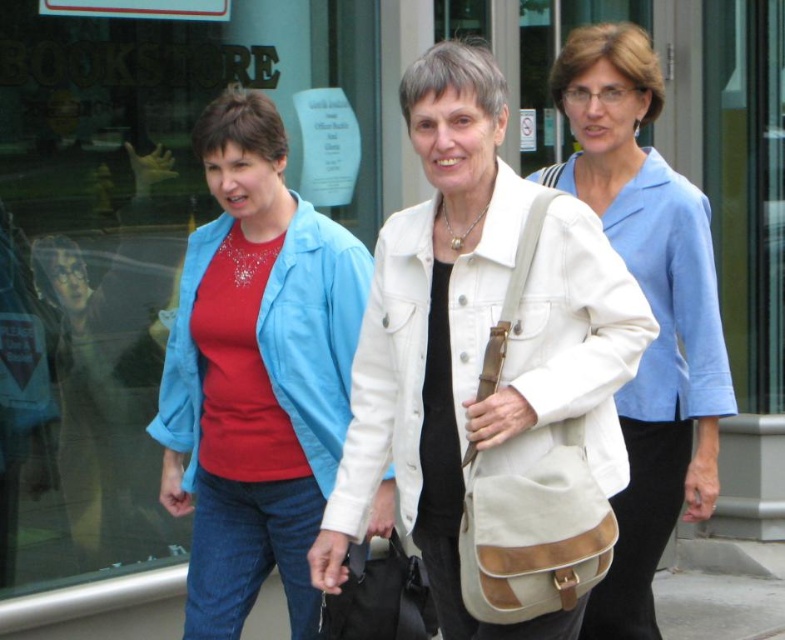
Question: Which object is positioned closest to the matte blue jacket at center?

Choices:
 (A) beige canvas briefcase at center
 (B) white canvas bag at center

Answer: (B)

Question: Which point appears farthest from the camera in this image?

Choices:
 (A) (279, 492)
 (B) (582, 173)
 (C) (466, 468)
 (D) (667, 392)

Answer: (B)

Question: Can you confirm if white canvas bag at center is positioned below matte blue jacket at center?

Choices:
 (A) yes
 (B) no

Answer: (B)

Question: Can you confirm if matte blue jacket at center is positioned to the right of beige canvas briefcase at center?

Choices:
 (A) no
 (B) yes

Answer: (A)

Question: Which object is positioned closest to the matte beige bag at center?

Choices:
 (A) white canvas jacket at center
 (B) beige canvas briefcase at center

Answer: (A)

Question: Does white canvas bag at center appear on the right side of white canvas jacket at center?

Choices:
 (A) no
 (B) yes

Answer: (A)